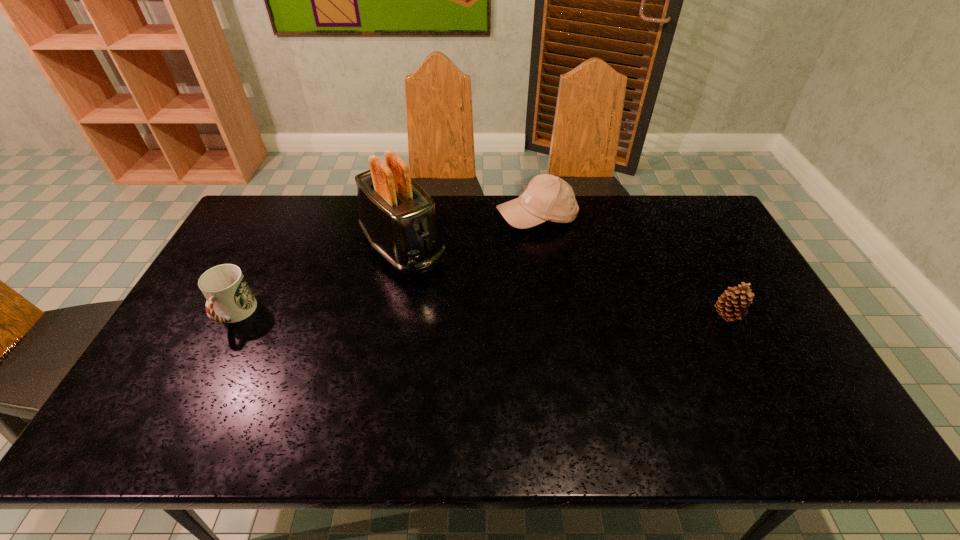
Where is `the leftmost object`? Image resolution: width=960 pixels, height=540 pixels. the leftmost object is located at coordinates (229, 298).

Find the location of a particular element. Image resolution: width=960 pixels, height=540 pixels. the rightmost object is located at coordinates (734, 301).

This screenshot has width=960, height=540. Identify the location of the tallest object. (398, 217).

You are a GUI agent. You are given a task and a screenshot of the screen. Output one action in this format:
    pyautogui.click(x=<x>, y=<y>)
    Task: Click on the third object from right to left
    The width and height of the screenshot is (960, 540).
    Given the screenshot: What is the action you would take?
    pyautogui.click(x=398, y=217)

The image size is (960, 540). I want to click on baseball cap, so click(547, 198).

What are the coordinates of `the second tallest object` in the screenshot? It's located at (547, 198).

What are the coordinates of `vacant space located 0.170m on the side of the leftmost object where the handle is located` in the screenshot? It's located at (194, 392).

Image resolution: width=960 pixels, height=540 pixels. Identify the location of free location located on the front of the pinecone. (749, 360).

I want to click on vacant point located 0.140m on the side of the third object from right to left with the control lever, so point(451,304).

Identify the location of free space located 0.160m on the side of the third object from right to left with the control lever. Image resolution: width=960 pixels, height=540 pixels. (455, 308).